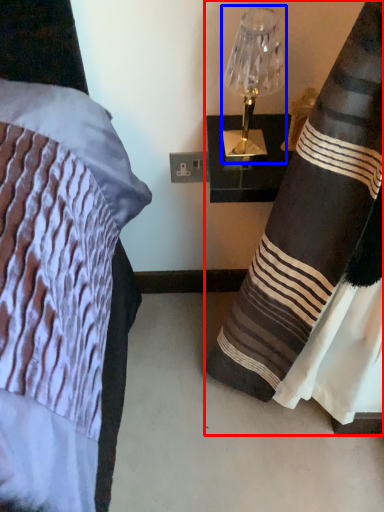
Question: Which object appears farthest to the camera in this image, curtain (highlighted by a red box) or lamp (highlighted by a blue box)?

Choices:
 (A) curtain
 (B) lamp

Answer: (B)